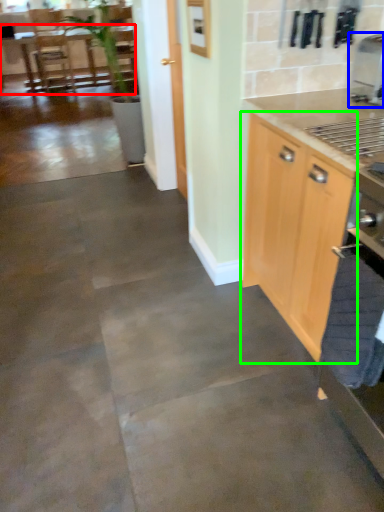
Question: Estimate the real-world distances between objects in this image. Which object is closer to table (highlighted by a red box), coffee machine (highlighted by a blue box) or cabinetry (highlighted by a green box)?

Choices:
 (A) coffee machine
 (B) cabinetry

Answer: (A)